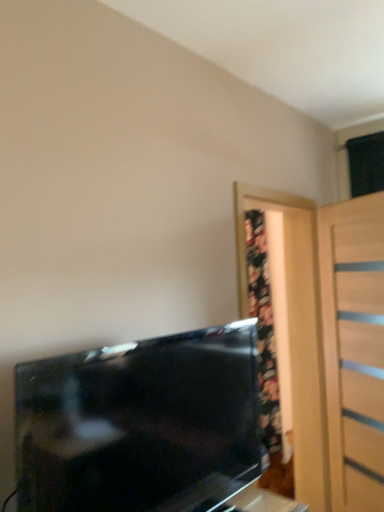
Question: From a real-world perspective, is matte black tv at lower left positioned under black glossy tv at lower left based on gravity?

Choices:
 (A) yes
 (B) no

Answer: (A)

Question: Is matte black tv at lower left completely or partially outside of black glossy tv at lower left?

Choices:
 (A) no
 (B) yes

Answer: (B)

Question: Can you confirm if matte black tv at lower left is positioned to the left of black glossy tv at lower left?

Choices:
 (A) yes
 (B) no

Answer: (B)

Question: Can you confirm if matte black tv at lower left is positioned to the right of black glossy tv at lower left?

Choices:
 (A) yes
 (B) no

Answer: (A)

Question: From the image's perspective, does matte black tv at lower left appear higher than black glossy tv at lower left?

Choices:
 (A) no
 (B) yes

Answer: (A)

Question: Is matte black tv at lower left positioned before black glossy tv at lower left?

Choices:
 (A) no
 (B) yes

Answer: (A)

Question: Is matte black tv at lower left at the left side of light wood door at right?

Choices:
 (A) yes
 (B) no

Answer: (A)

Question: Can you confirm if matte black tv at lower left is taller than light wood door at right?

Choices:
 (A) no
 (B) yes

Answer: (A)

Question: Are matte black tv at lower left and light wood door at right beside each other?

Choices:
 (A) no
 (B) yes

Answer: (A)

Question: Is matte black tv at lower left not inside light wood door at right?

Choices:
 (A) yes
 (B) no

Answer: (A)

Question: Is matte black tv at lower left positioned in front of light wood door at right?

Choices:
 (A) yes
 (B) no

Answer: (A)

Question: Is matte black tv at lower left to the right of light wood door at right from the viewer's perspective?

Choices:
 (A) yes
 (B) no

Answer: (B)

Question: Does light wood door at right have a smaller size compared to matte black tv at lower left?

Choices:
 (A) no
 (B) yes

Answer: (A)